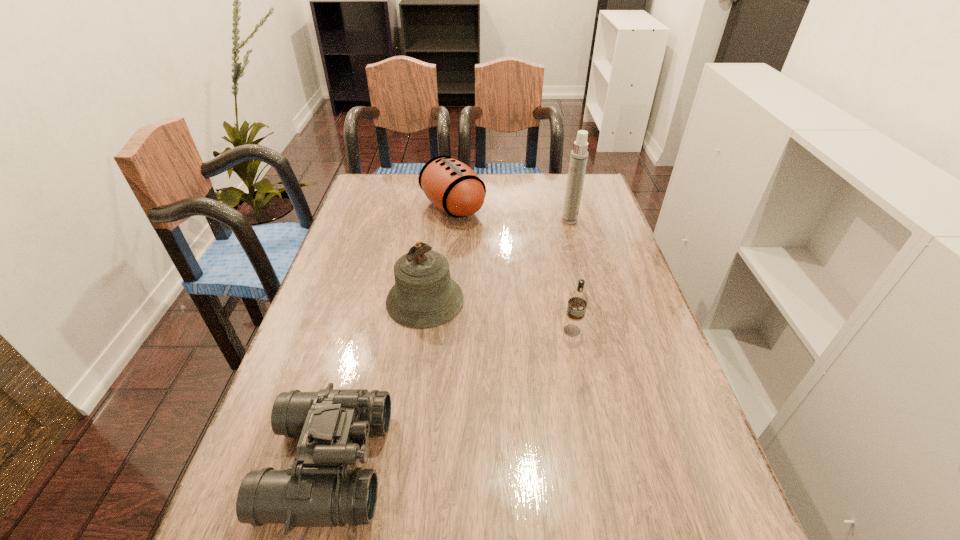
Find the location of `aerosol can`. aerosol can is located at coordinates (578, 160).

Find the location of a particular element. the tallest object is located at coordinates (578, 160).

Image resolution: width=960 pixels, height=540 pixels. Identify the location of bell. (424, 295).

Locate an element on the screen. Image resolution: width=960 pixels, height=540 pixels. football (American) is located at coordinates pos(453,187).

I want to click on the fourth object from left to right, so click(x=577, y=300).

This screenshot has height=540, width=960. I want to click on blank space located 0.280m on the back of the rightmost object, so click(x=557, y=176).

Find the location of a particular element. This screenshot has width=960, height=540. vacant space situated on the back of the bell is located at coordinates (434, 232).

I want to click on vacant region located on the left of the football (American), so (x=378, y=207).

You are a GUI agent. You are given a task and a screenshot of the screen. Output one action in this format:
    pyautogui.click(x=<x>, y=<y>)
    Task: Click on the vacant space located 0.340m on the label of the vodka
    This screenshot has width=960, height=540.
    Given the screenshot: What is the action you would take?
    pyautogui.click(x=604, y=480)

Where is `object present at the far edge`? The height and width of the screenshot is (540, 960). object present at the far edge is located at coordinates (453, 187).